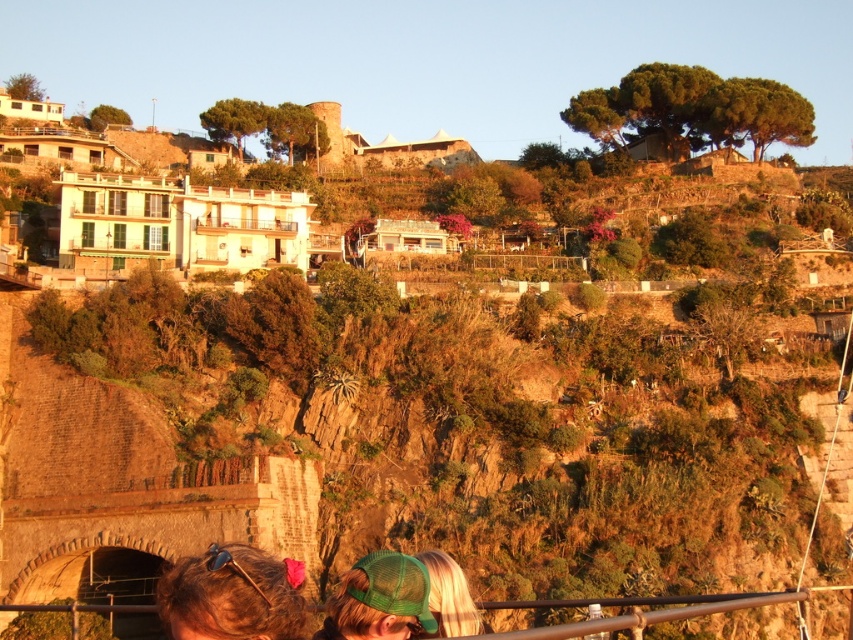
Can you confirm if green mesh cap at lower center is positioned above brown hair at lower left?

Incorrect, green mesh cap at lower center is not positioned above brown hair at lower left.

Where is `green mesh cap at lower center`? The width and height of the screenshot is (853, 640). green mesh cap at lower center is located at coordinates (231, 595).

Is point (257, 620) farther from camera compared to point (236, 586)?

No, it is not.

Find the location of a particular element. Image resolution: width=853 pixels, height=640 pixels. green mesh cap at lower center is located at coordinates (231, 595).

Which is more to the left, brown hair at lower left or blonde hair at lower center?

From the viewer's perspective, brown hair at lower left appears more on the left side.

Can you confirm if brown hair at lower left is positioned below blonde hair at lower center?

Yes.

The image size is (853, 640). Identify the location of brown hair at lower left. tap(231, 595).

Find the location of a particular element. This screenshot has width=853, height=640. brown hair at lower left is located at coordinates (231, 595).

Is point (426, 582) positioned after point (428, 579)?

No, it is in front of (428, 579).

Between green mesh cap at lower center and blonde hair at lower center, which one is positioned higher?

blonde hair at lower center is above.

You are a GUI agent. You are given a task and a screenshot of the screen. Output one action in this format:
    pyautogui.click(x=<x>, y=<y>)
    Task: Click on the green mesh cap at lower center
    This screenshot has height=640, width=853.
    Given the screenshot: What is the action you would take?
    click(231, 595)